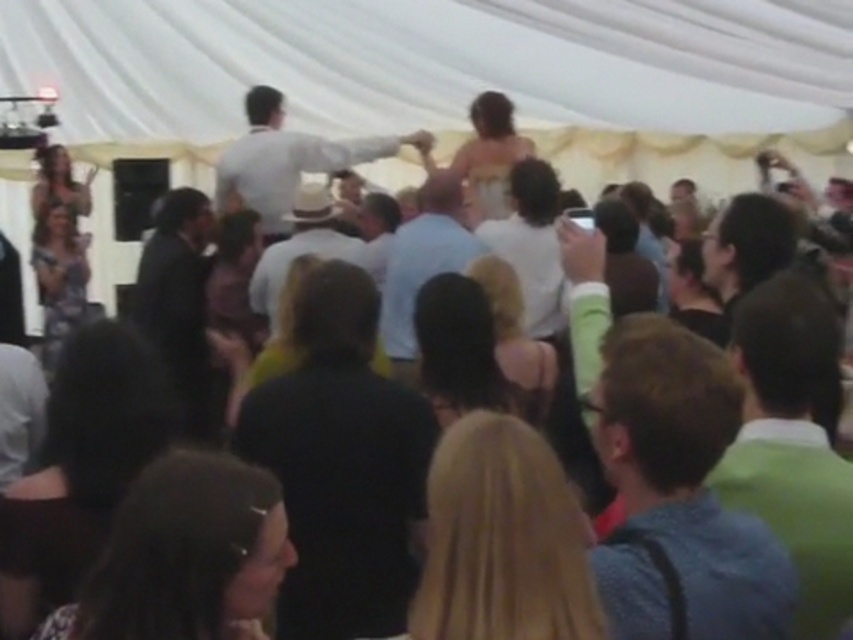
Question: Does black matte shirt at center appear over green fabric shirt at right?

Choices:
 (A) no
 (B) yes

Answer: (A)

Question: Which object appears closest to the camera in this image?

Choices:
 (A) white shirt at center
 (B) light blue shirt at center

Answer: (B)

Question: Considering the relative positions of black matte shirt at center and blue denim shirt at center in the image provided, where is black matte shirt at center located with respect to blue denim shirt at center?

Choices:
 (A) right
 (B) left

Answer: (B)

Question: Does black matte shirt at center lie behind light brown straw hat at center?

Choices:
 (A) yes
 (B) no

Answer: (B)

Question: Which point appears closest to the camera in this image?

Choices:
 (A) (389, 596)
 (B) (782, 448)
 (C) (733, 636)
 (D) (321, 168)

Answer: (C)

Question: Which point is farther to the camera?

Choices:
 (A) (750, 589)
 (B) (407, 330)
 (C) (270, 138)

Answer: (C)